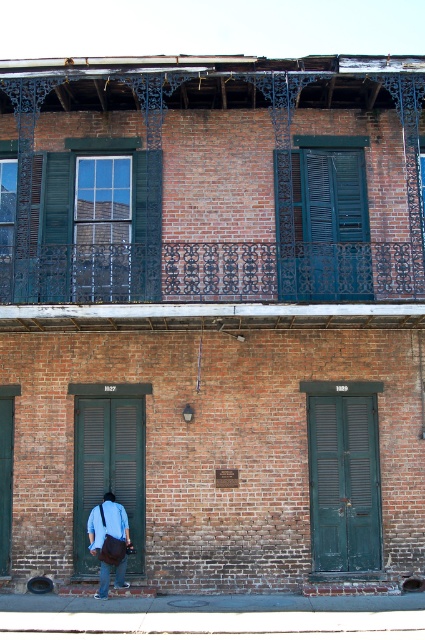
Question: Which of the following is the closest to the observer?

Choices:
 (A) denim jacket at lower left
 (B) white matte dress shirt at lower left

Answer: (A)

Question: Is green wrought iron balcony at upper center to the left of dark teal wrought iron balcony at upper center from the viewer's perspective?

Choices:
 (A) no
 (B) yes

Answer: (B)

Question: Among these objects, which one is nearest to the camera?

Choices:
 (A) white matte dress shirt at lower left
 (B) denim jacket at lower left
 (C) dark teal wrought iron balcony at upper center
 (D) green wrought iron balcony at upper center

Answer: (B)

Question: Can you confirm if denim jacket at lower left is positioned below white matte dress shirt at lower left?

Choices:
 (A) yes
 (B) no

Answer: (A)

Question: Among these points, which one is nearest to the camera?

Choices:
 (A) (8, 268)
 (B) (258, 230)
 (C) (96, 515)
 (D) (121, 582)

Answer: (D)

Question: Can you confirm if denim jacket at lower left is positioned to the right of white matte dress shirt at lower left?

Choices:
 (A) no
 (B) yes

Answer: (B)